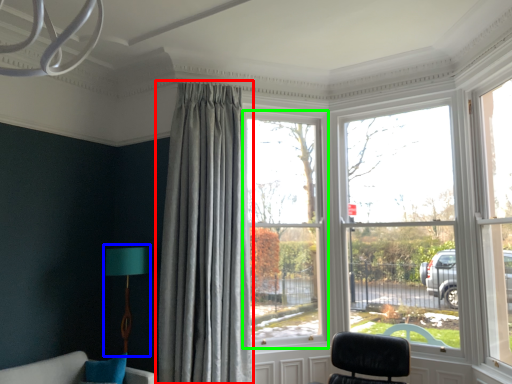
Question: Which is farther away from curtain (highlighted by a red box)? table lamp (highlighted by a blue box) or window (highlighted by a green box)?

Choices:
 (A) table lamp
 (B) window

Answer: (A)